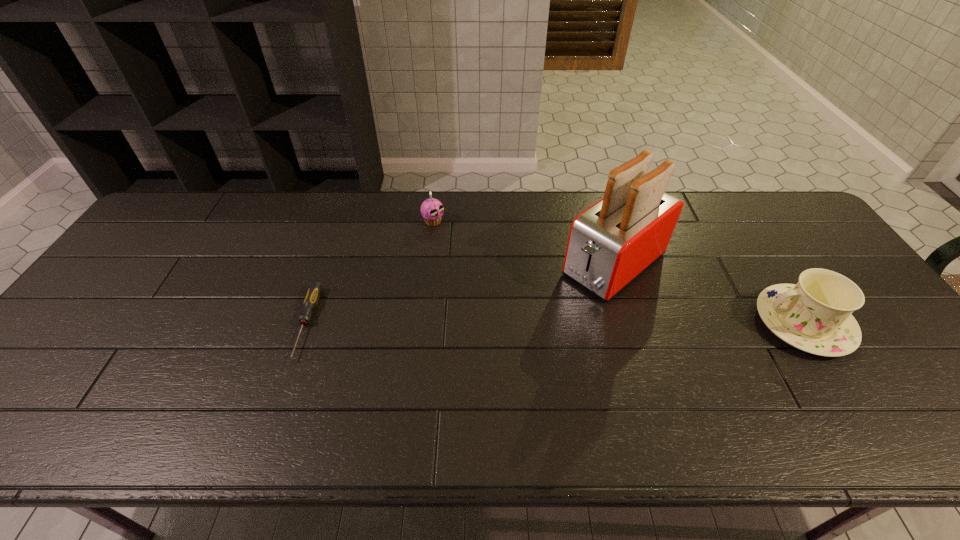
The height and width of the screenshot is (540, 960). I want to click on free space located on the handle side of the rightmost object, so click(737, 323).

The height and width of the screenshot is (540, 960). Identify the location of free point located on the face of the farthest object. (462, 242).

Find the location of a particular element. This screenshot has width=960, height=540. vacant point located 0.110m on the face of the farthest object is located at coordinates (464, 244).

Where is `free spot located on the face of the farthest object`? free spot located on the face of the farthest object is located at coordinates (507, 274).

Where is `free spot located 0.270m on the front-facing side of the toaster`? free spot located 0.270m on the front-facing side of the toaster is located at coordinates (512, 346).

You are a GUI agent. You are given a task and a screenshot of the screen. Output one action in this format:
    pyautogui.click(x=<x>, y=<y>)
    Task: Click on the vacant space positioned 0.140m on the front-facing side of the toaster
    
    Given the screenshot: What is the action you would take?
    pyautogui.click(x=546, y=318)

What are the coordinates of `vacant space positioned 0.080m on the front-facing side of the toaster` in the screenshot? It's located at (562, 306).

This screenshot has height=540, width=960. Identify the location of cupcake that is at the far edge. (432, 210).

Locate an element on the screen. The height and width of the screenshot is (540, 960). toaster that is positioned at the far edge is located at coordinates (612, 242).

Locate an element on the screen. object situated at the right edge is located at coordinates (815, 315).